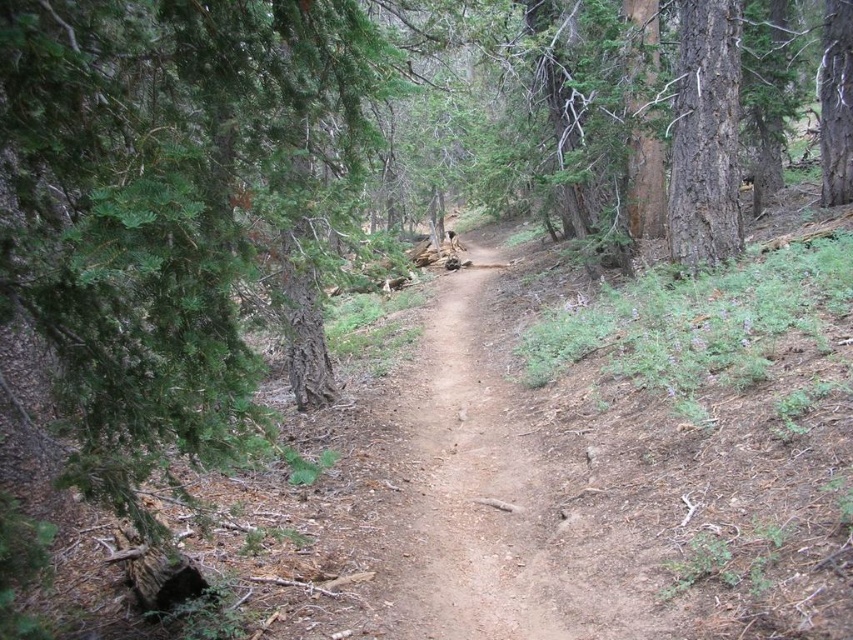
Who is positioned more to the right, dirt path at center or smooth brown tree trunk at right?

From the viewer's perspective, smooth brown tree trunk at right appears more on the right side.

Is point (415, 424) in front of point (668, 220)?

That is True.

Does point (462, 582) come in front of point (674, 161)?

Yes, it is in front of point (674, 161).

This screenshot has width=853, height=640. In order to click on dirt path at center in this screenshot , I will do pos(463,484).